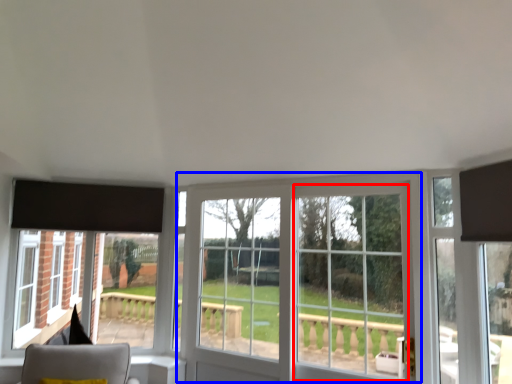
Question: Which point is closer to the camera, glass door (highlighted by a red box) or window (highlighted by a blue box)?

Choices:
 (A) glass door
 (B) window

Answer: (A)